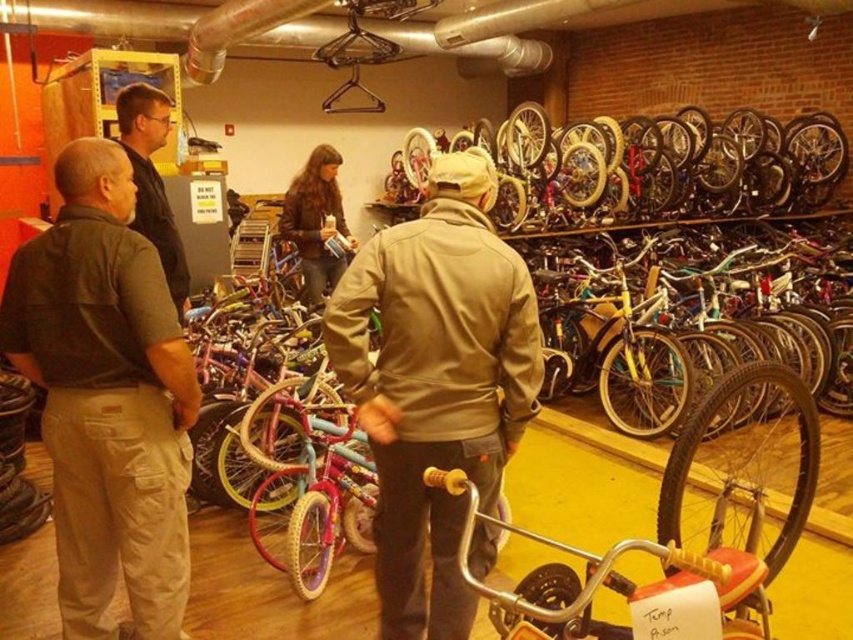
Question: Is dark brown cargo pants at left to the right of dark brown leather jacket at left from the viewer's perspective?

Choices:
 (A) no
 (B) yes

Answer: (B)

Question: Which of the following is the closest to the observer?

Choices:
 (A) (148, 186)
 (B) (71, 225)
 (C) (328, 160)
 (D) (387, 584)

Answer: (B)

Question: Is dark brown cargo pants at left closer to camera compared to brown leather jacket at center?

Choices:
 (A) no
 (B) yes

Answer: (B)

Question: Is tan softshell jacket at center bigger than brown leather jacket at center?

Choices:
 (A) no
 (B) yes

Answer: (B)

Question: Which is farther from the tan softshell jacket at center?

Choices:
 (A) dark brown cargo pants at left
 (B) brown leather jacket at center

Answer: (B)

Question: Estimate the real-world distances between objects in this image. Which object is closer to the dark brown leather jacket at left?

Choices:
 (A) dark brown cargo pants at left
 (B) brown leather jacket at center

Answer: (A)